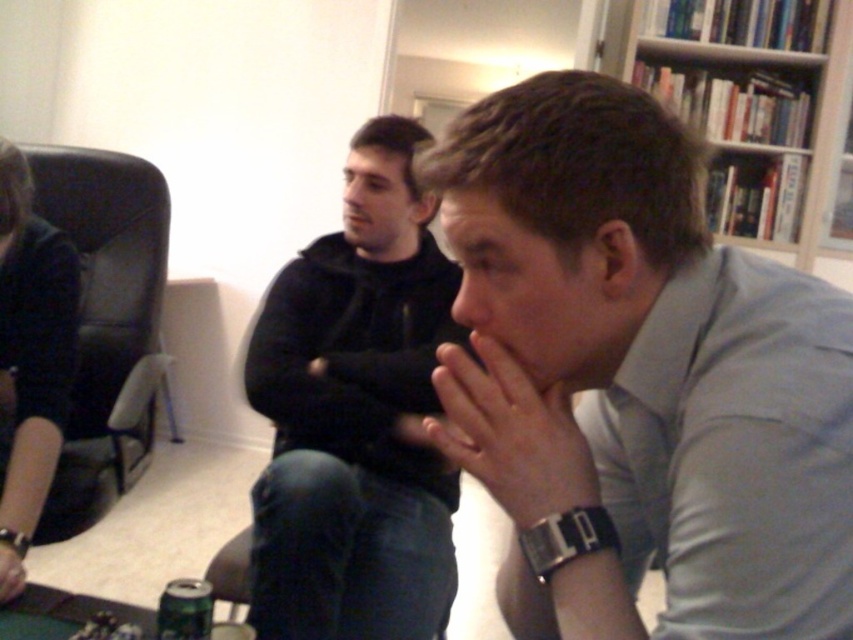
Who is lower down, white paper bookshelf at upper right or black leather jacket at left?

Positioned lower is black leather jacket at left.

Does white paper bookshelf at upper right come behind black leather jacket at left?

Yes, white paper bookshelf at upper right is behind black leather jacket at left.

Which is behind, point (697, 8) or point (28, 256)?

Point (697, 8)

The width and height of the screenshot is (853, 640). Find the location of `white paper bookshelf at upper right`. white paper bookshelf at upper right is located at coordinates (753, 109).

Can you confirm if black leather jacket at left is shorter than metallic green can at lower left?

No, black leather jacket at left is not shorter than metallic green can at lower left.

Does black leather jacket at left appear on the left side of metallic green can at lower left?

Yes, black leather jacket at left is to the left of metallic green can at lower left.

Describe the element at coordinates (32, 348) in the screenshot. I see `black leather jacket at left` at that location.

Locate an element on the screen. This screenshot has width=853, height=640. black leather jacket at left is located at coordinates (32, 348).

Which is below, black hoodie at center or smooth skin hand at center?

Positioned lower is smooth skin hand at center.

Is point (373, 592) positioned in front of point (498, 368)?

That is False.

Find the location of a particular element. This screenshot has height=640, width=853. black hoodie at center is located at coordinates (357, 416).